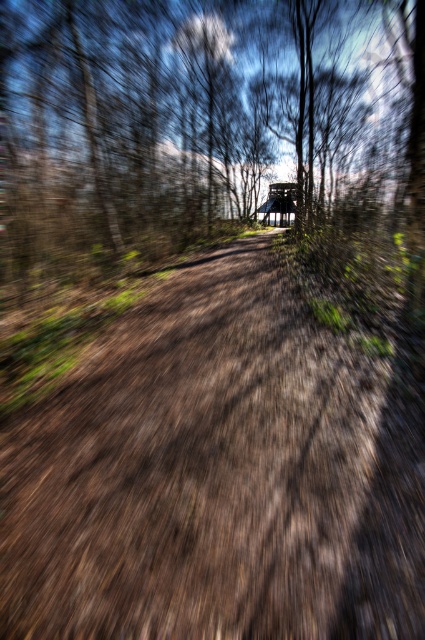
Which is in front, point (163, 349) or point (283, 205)?

Positioned in front is point (163, 349).

Which is above, brown dirt track at center or wooden hut at center?

wooden hut at center

Is point (56, 413) positioned after point (275, 212)?

No.

Where is `brown dirt track at center`? This screenshot has width=425, height=640. brown dirt track at center is located at coordinates (215, 476).